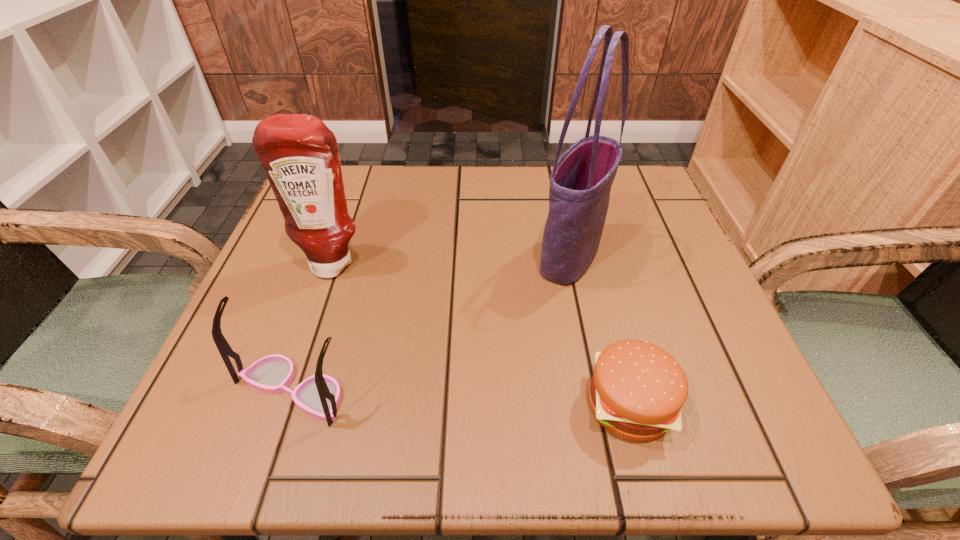
Locate an element on the screen. The width and height of the screenshot is (960, 540). vacant region that satisfies the following two spatial constraints: 1. on the back side of the third tallest object; 2. on the right side of the tallest object is located at coordinates (339, 255).